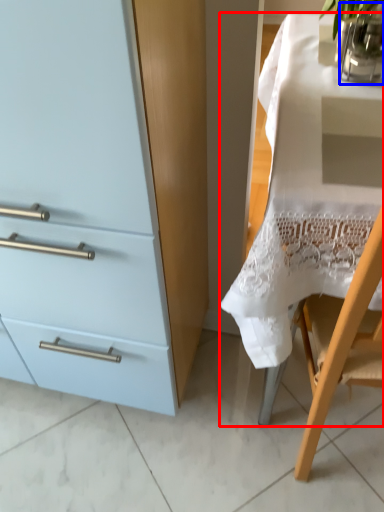
Question: Which of the following is the farthest to the observer, desk (highlighted by a red box) or glass vase (highlighted by a blue box)?

Choices:
 (A) desk
 (B) glass vase

Answer: (B)